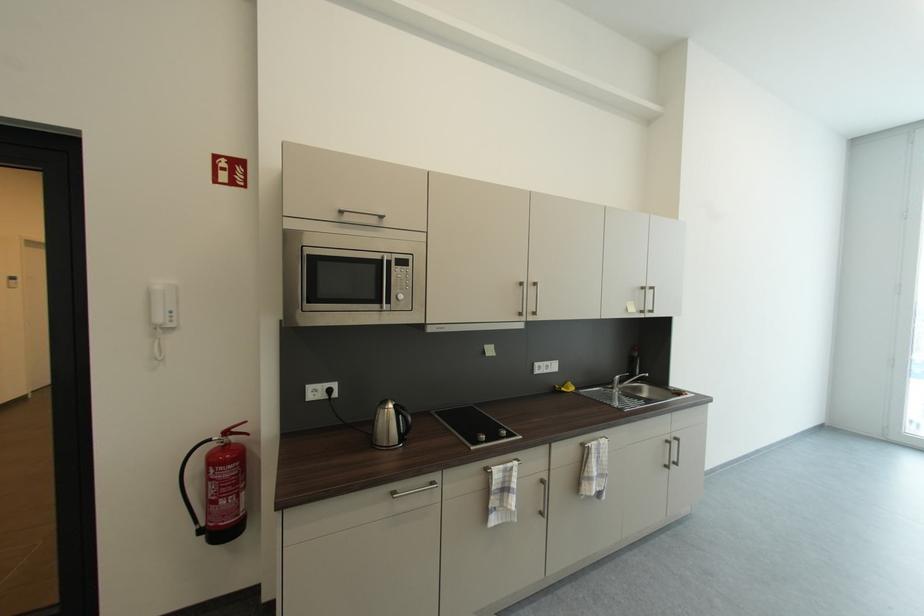
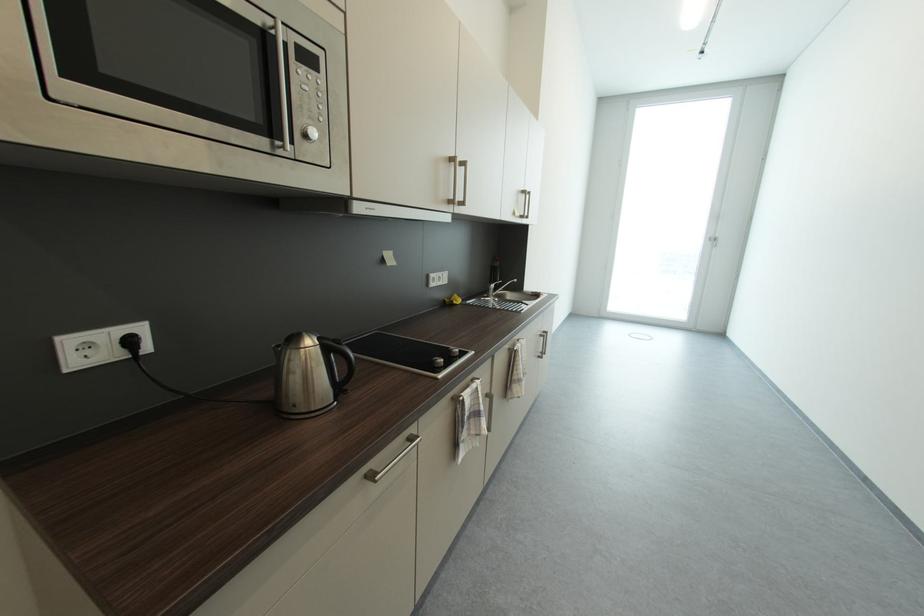
Find the pixel in the second image that matches (407,278) in the first image.

(313, 89)